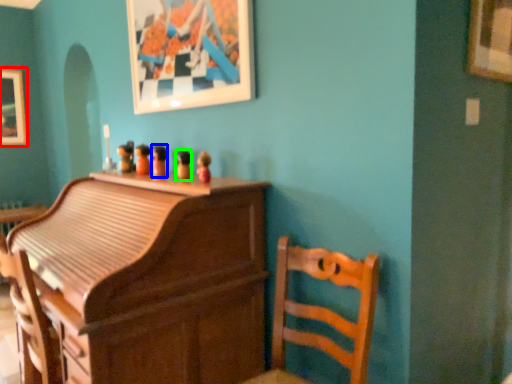
Question: Which is farther away from picture frame (highlighted by a red box)? toy (highlighted by a blue box) or toy (highlighted by a green box)?

Choices:
 (A) toy
 (B) toy

Answer: (B)